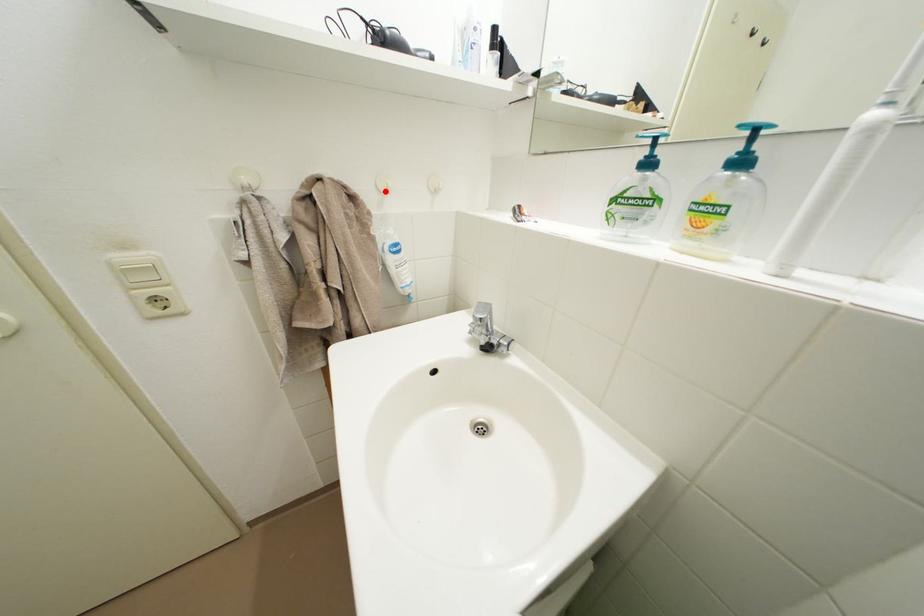
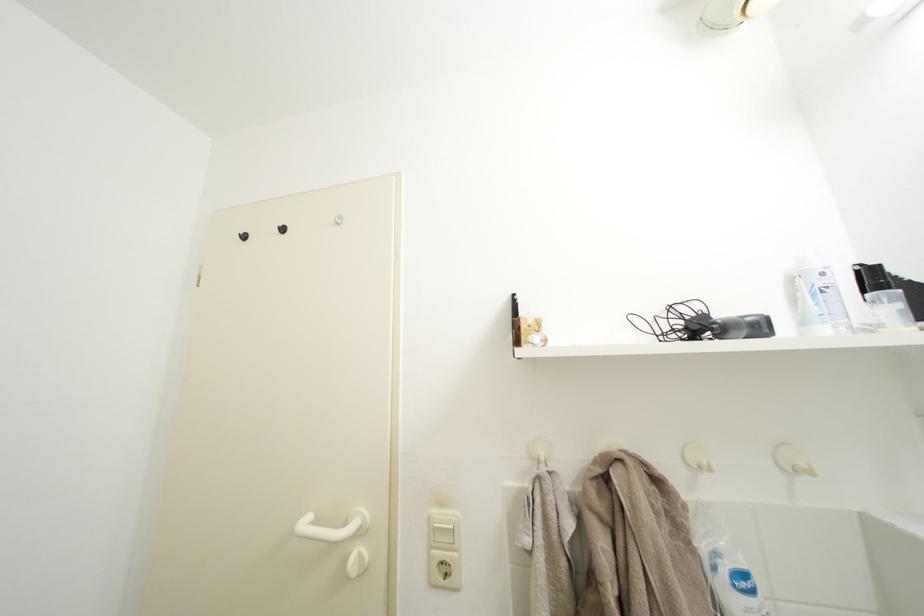
Find the pixel in the second image that matches the highlighted location in the first image.

(694, 464)